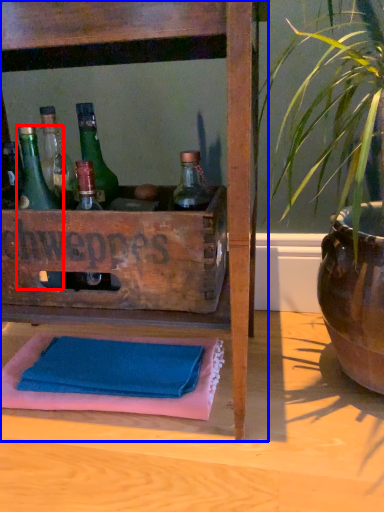
Question: Among these objects, which one is farthest to the camera, bottle (highlighted by a red box) or furniture (highlighted by a blue box)?

Choices:
 (A) bottle
 (B) furniture

Answer: (A)